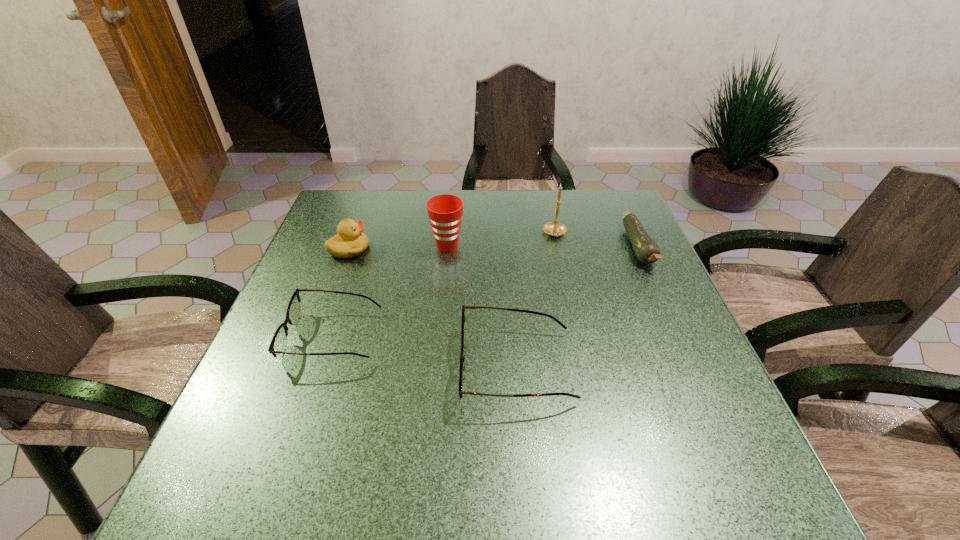
Given the evenly spaced spectacless in the image, where should an extra spectacles be added on the right to preserve the spacing? Please point to a vacant space. Please provide its 2D coordinates. Your answer should be formatted as a tuple, i.e. [(x, y)], where the tuple contains the x and y coordinates of a point satisfying the conditions above.

[(728, 402)]